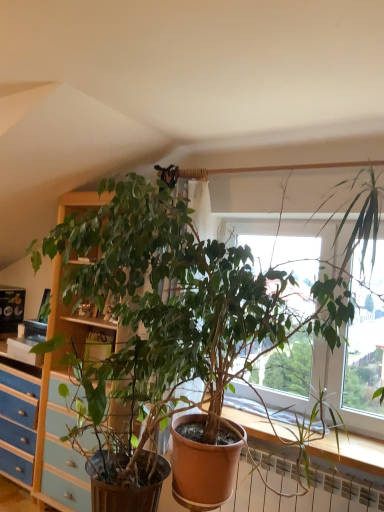
Measure the distance between white metallic radiator at lower right and camera.

6.02 feet.

This screenshot has width=384, height=512. Describe the element at coordinates (304, 496) in the screenshot. I see `white metallic radiator at lower right` at that location.

At what (x,y) coordinates should I click in order to perform the action: click on white metallic radiator at lower right. Please return your answer as a coordinate pair (x, y). This screenshot has width=384, height=512. Looking at the image, I should click on (304, 496).

You are a GUI agent. You are given a task and a screenshot of the screen. Output one action in this format:
    pyautogui.click(x=<x>, y=<y>)
    Task: Click on the white metallic radiator at lower right
    The width and height of the screenshot is (384, 512).
    Given the screenshot: What is the action you would take?
    tap(304, 496)